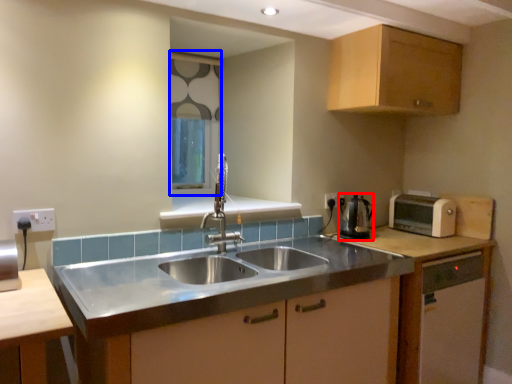
Question: Which object appears closest to the camera in this image, appliance (highlighted by a red box) or window screen (highlighted by a blue box)?

Choices:
 (A) appliance
 (B) window screen

Answer: (A)